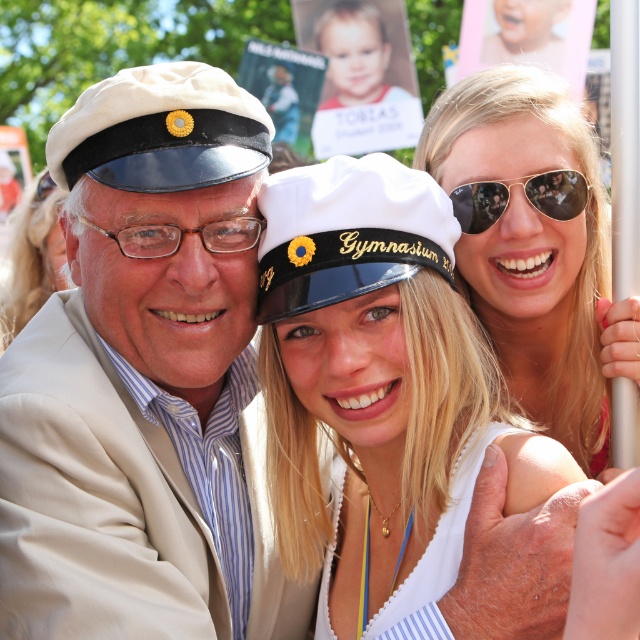
In the scene with the young woman wearing a matte white cap at center and blonde hair at center, which object is closer to the viewer?

The matte white cap at center is closer to the viewer than the blonde hair at center.

You are a photographer trying to capture a closeup shot of the sunglasses at upper right and the tortoiseshell plastic glasses at center. Which object is located more to the right side of the frame?

The sunglasses at upper right is positioned on the right side of tortoiseshell plastic glasses at center, so the sunglasses at upper right is more to the right side of the frame.